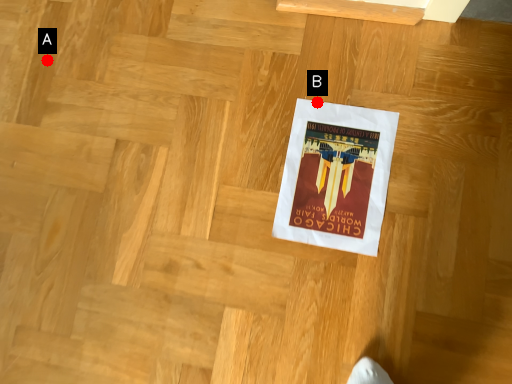
Question: Two points are circled on the image, labeled by A and B beside each circle. Among these points, which one is farthest from the camera?

Choices:
 (A) A is further
 (B) B is further

Answer: (A)